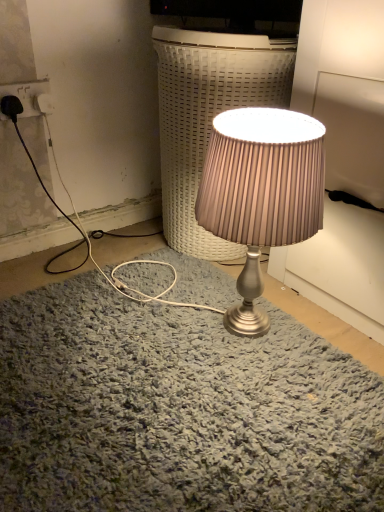
Question: Does satin silver lamp at center appear on the left side of satin silver lamp at center?

Choices:
 (A) no
 (B) yes

Answer: (A)

Question: Does satin silver lamp at center have a lesser height compared to satin silver lamp at center?

Choices:
 (A) yes
 (B) no

Answer: (A)

Question: Is satin silver lamp at center smaller than satin silver lamp at center?

Choices:
 (A) no
 (B) yes

Answer: (B)

Question: Is satin silver lamp at center not close to satin silver lamp at center?

Choices:
 (A) no
 (B) yes

Answer: (A)

Question: From the image's perspective, is satin silver lamp at center located beneath satin silver lamp at center?

Choices:
 (A) no
 (B) yes

Answer: (B)

Question: Is point (309, 234) closer or farther from the camera than point (36, 82)?

Choices:
 (A) farther
 (B) closer

Answer: (B)

Question: From a real-world perspective, relative to white plastic socket at upper left, is satin silver lamp at center vertically above or below?

Choices:
 (A) above
 (B) below

Answer: (B)

Question: Based on their positions, is satin silver lamp at center located to the left or right of white plastic socket at upper left?

Choices:
 (A) left
 (B) right

Answer: (B)

Question: In terms of width, does satin silver lamp at center look wider or thinner when compared to white plastic socket at upper left?

Choices:
 (A) thin
 (B) wide

Answer: (B)

Question: In terms of width, does satin silver lamp at center look wider or thinner when compared to satin silver lamp at center?

Choices:
 (A) thin
 (B) wide

Answer: (B)

Question: Is point (256, 54) closer or farther from the camera than point (291, 132)?

Choices:
 (A) farther
 (B) closer

Answer: (A)

Question: Is satin silver lamp at center inside the boundaries of satin silver lamp at center, or outside?

Choices:
 (A) outside
 (B) inside

Answer: (A)

Question: Based on their sizes in the image, would you say satin silver lamp at center is bigger or smaller than satin silver lamp at center?

Choices:
 (A) big
 (B) small

Answer: (A)

Question: Based on their sizes in the image, would you say satin silver lamp at center is bigger or smaller than white plastic socket at upper left?

Choices:
 (A) big
 (B) small

Answer: (A)

Question: Relative to white plastic socket at upper left, is satin silver lamp at center in front or behind?

Choices:
 (A) behind
 (B) front

Answer: (B)